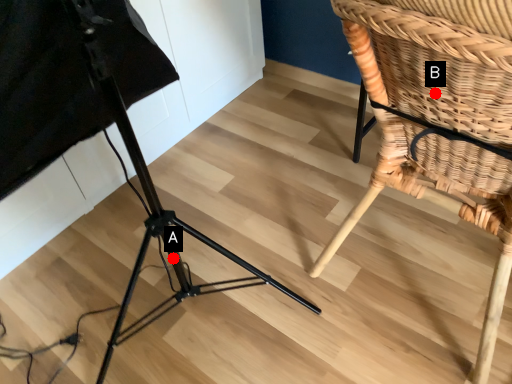
Question: Two points are circled on the image, labeled by A and B beside each circle. Which point is further to the camera?

Choices:
 (A) A is further
 (B) B is further

Answer: (A)